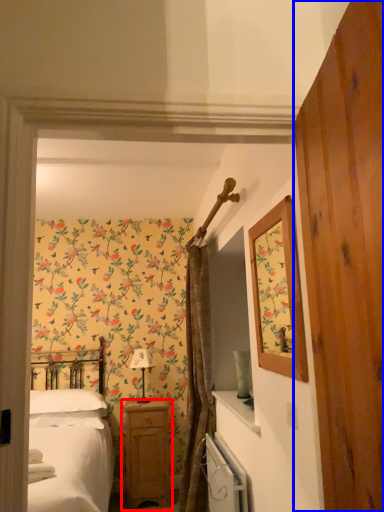
Question: Which object appears farthest to the camera in this image, nightstand (highlighted by a red box) or barn door (highlighted by a blue box)?

Choices:
 (A) nightstand
 (B) barn door

Answer: (A)